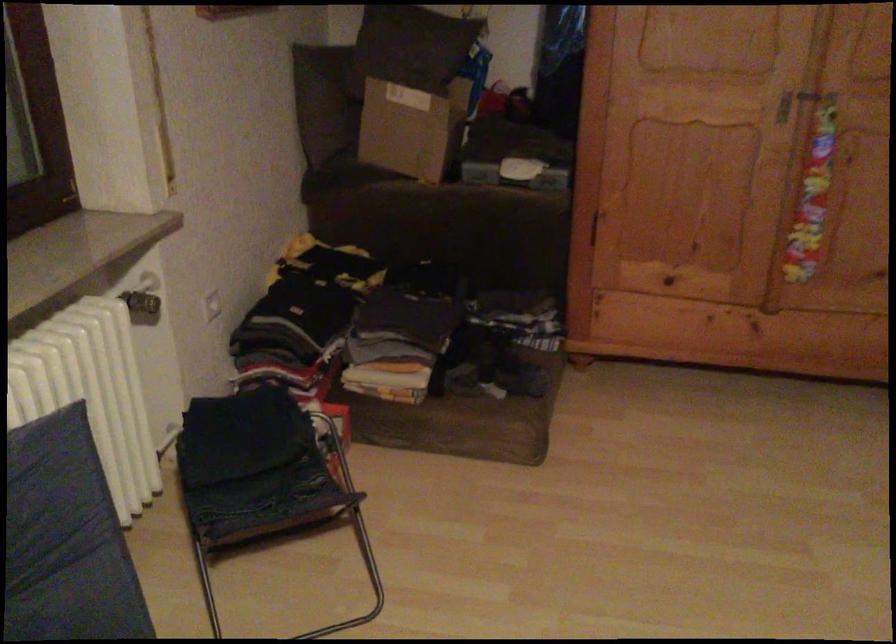
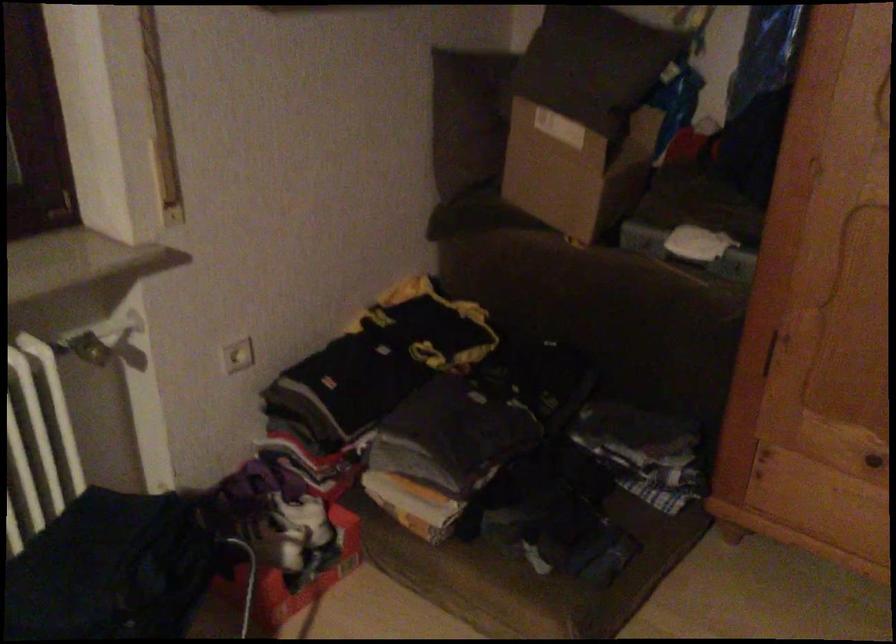
What movement of the cameraman would produce the second image?

The cameraman moved toward right, forward.